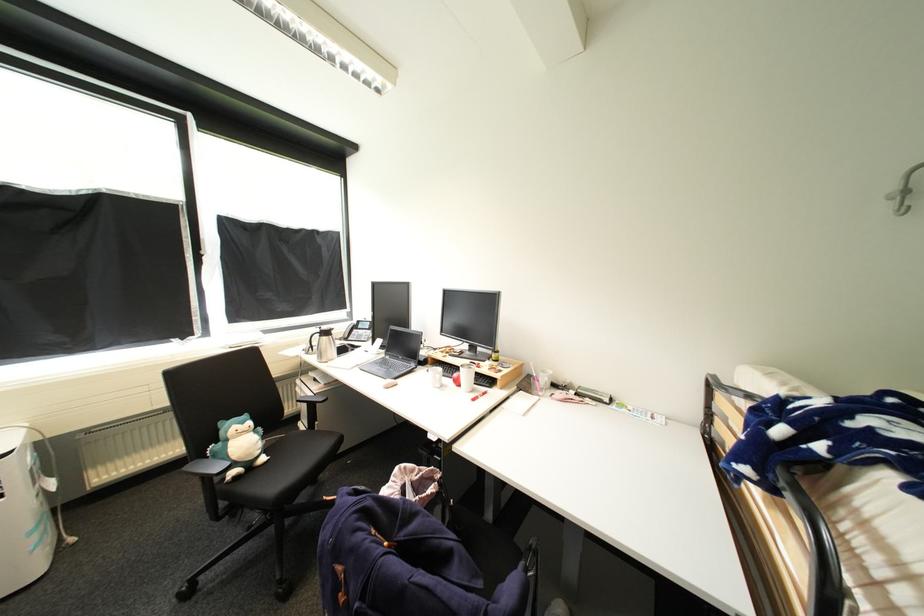
Describe the element at coordinates (903, 191) in the screenshot. I see `the metal wall hook` at that location.